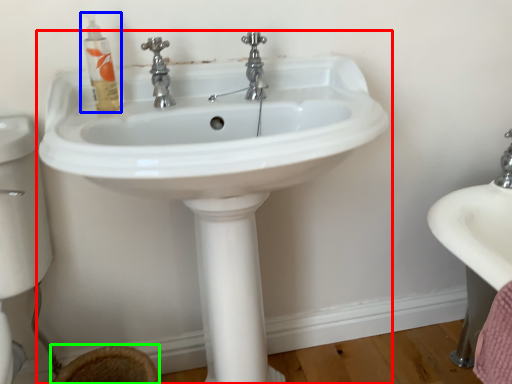
Question: Considering the real-world distances, which object is farthest from sink (highlighted by a red box)? mouthwash (highlighted by a blue box) or toilet bowl (highlighted by a green box)?

Choices:
 (A) mouthwash
 (B) toilet bowl

Answer: (B)